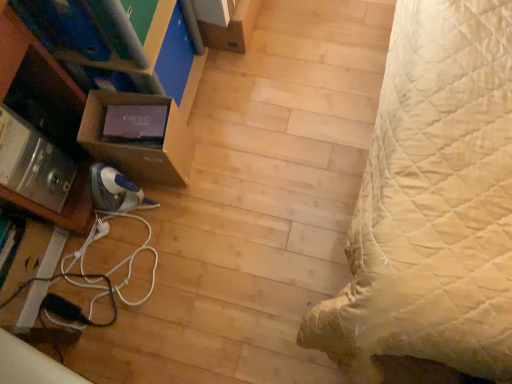
What is the approximate width of matte black monitor at left?

matte black monitor at left is 35.05 centimeters wide.

What do you see at coordinates (26, 51) in the screenshot?
I see `matte black monitor at left` at bounding box center [26, 51].

You are a GUI agent. You are given a task and a screenshot of the screen. Output one action in this format:
    pyautogui.click(x=<x>, y=<y>)
    Task: Click on the metallic silver shelf at lower left, arranged as the first shelf when viewed from the left
    This screenshot has width=512, height=384.
    Given the screenshot: What is the action you would take?
    pyautogui.click(x=35, y=67)

Measure the distance between metallic silver shelf at lower left, arranged as the first shelf when viewed from the left, and camera.

metallic silver shelf at lower left, arranged as the first shelf when viewed from the left, is 30.15 inches away from camera.

At what (x,y) coordinates should I click in order to perform the action: click on matte black monitor at left. Please return your answer as a coordinate pair (x, y). Looking at the image, I should click on (26, 51).

Is metallic silver shelf at lower left, arranged as the first shelf when viewed from the left, shorter than brown cardboard box at left, the 2th shelf positioned from the left?

No.

Considering the positions of objects metallic silver shelf at lower left, marked as the 2th shelf in a right-to-left arrangement, and brown cardboard box at left, the 2th shelf positioned from the left, in the image provided, who is in front, metallic silver shelf at lower left, marked as the 2th shelf in a right-to-left arrangement, or brown cardboard box at left, the 2th shelf positioned from the left,?

metallic silver shelf at lower left, marked as the 2th shelf in a right-to-left arrangement, is closer to the camera.

How different are the orientations of metallic silver shelf at lower left, marked as the 2th shelf in a right-to-left arrangement, and brown cardboard box at left, placed as the 1th shelf when sorted from right to left, in degrees?

The angle between the facing direction of metallic silver shelf at lower left, marked as the 2th shelf in a right-to-left arrangement, and the facing direction of brown cardboard box at left, placed as the 1th shelf when sorted from right to left, is 0.000542 degrees.

Is point (58, 77) positioned behind point (170, 170)?

No, (58, 77) is in front of (170, 170).

Does brown cardboard box at left, the 2th shelf positioned from the left, have a greater width compared to white cord at lower left?

Indeed, brown cardboard box at left, the 2th shelf positioned from the left, has a greater width compared to white cord at lower left.

Is white cord at lower left at the back of brown cardboard box at left, placed as the 1th shelf when sorted from right to left?

brown cardboard box at left, placed as the 1th shelf when sorted from right to left, does not have its back to white cord at lower left.

At what (x,y) coordinates should I click in order to perform the action: click on shelf that appears on the right of white cord at lower left. Please return your answer as a coordinate pair (x, y). Image resolution: width=512 pixels, height=384 pixels. Looking at the image, I should click on (140, 146).

Can we say brown cardboard box at left, placed as the 1th shelf when sorted from right to left, lies outside white cord at lower left?

Yes, brown cardboard box at left, placed as the 1th shelf when sorted from right to left, is located beyond the bounds of white cord at lower left.

Can you confirm if white cord at lower left is shorter than metallic silver shelf at lower left, marked as the 2th shelf in a right-to-left arrangement?

Indeed, white cord at lower left has a lesser height compared to metallic silver shelf at lower left, marked as the 2th shelf in a right-to-left arrangement.

From the image's perspective, count 1st shelfs upward from the white cord at lower left and point to it. Please provide its 2D coordinates.

[(35, 67)]

Is white cord at lower left wider than metallic silver shelf at lower left, marked as the 2th shelf in a right-to-left arrangement?

In fact, white cord at lower left might be narrower than metallic silver shelf at lower left, marked as the 2th shelf in a right-to-left arrangement.

From the image's perspective, is white cord at lower left on metallic silver shelf at lower left, arranged as the first shelf when viewed from the left?

Incorrect, from the image's perspective, white cord at lower left is lower than metallic silver shelf at lower left, arranged as the first shelf when viewed from the left.

Who is more distant, white cord at lower left or matte black monitor at left?

white cord at lower left is more distant.

Is white cord at lower left far away from matte black monitor at left?

No, white cord at lower left is in close proximity to matte black monitor at left.

Is white cord at lower left oriented away from matte black monitor at left?

That's not correct — white cord at lower left is not looking away from matte black monitor at left.

I want to click on cable lying behind the matte black monitor at left, so click(x=105, y=273).

Image resolution: width=512 pixels, height=384 pixels. What are the coordinates of `the 1st shelf located beneath the matte black monitor at left (from a real-world perspective)` in the screenshot? It's located at (35, 67).

Considering the points (69, 78) and (19, 200), which point is in front, point (69, 78) or point (19, 200)?

The point (19, 200) is more forward.

Is metallic silver shelf at lower left, marked as the 2th shelf in a right-to-left arrangement, far from matte black monitor at left?

metallic silver shelf at lower left, marked as the 2th shelf in a right-to-left arrangement, is near matte black monitor at left, not far away.

Considering the sizes of objects metallic silver shelf at lower left, arranged as the first shelf when viewed from the left, and matte black monitor at left in the image provided, who is wider, metallic silver shelf at lower left, arranged as the first shelf when viewed from the left, or matte black monitor at left?

matte black monitor at left.

From a real-world perspective, is matte black monitor at left positioned above or below white cord at lower left?

matte black monitor at left is above white cord at lower left.

Does matte black monitor at left have a greater width compared to white cord at lower left?

Indeed, matte black monitor at left has a greater width compared to white cord at lower left.

Considering the relative sizes of matte black monitor at left and white cord at lower left in the image provided, is matte black monitor at left taller than white cord at lower left?

Yes.

Is matte black monitor at left not inside metallic silver shelf at lower left, arranged as the first shelf when viewed from the left?

Yes.

Relative to metallic silver shelf at lower left, marked as the 2th shelf in a right-to-left arrangement, is matte black monitor at left in front or behind?

Clearly, matte black monitor at left is in front of metallic silver shelf at lower left, marked as the 2th shelf in a right-to-left arrangement.

Is matte black monitor at left bigger than metallic silver shelf at lower left, arranged as the first shelf when viewed from the left?

Yes, matte black monitor at left is bigger than metallic silver shelf at lower left, arranged as the first shelf when viewed from the left.

Considering the positions of objects matte black monitor at left and metallic silver shelf at lower left, arranged as the first shelf when viewed from the left, in the image provided, who is more to the right, matte black monitor at left or metallic silver shelf at lower left, arranged as the first shelf when viewed from the left,?

matte black monitor at left is more to the right.

In order to click on shelf located in front of the brown cardboard box at left, the 2th shelf positioned from the left in this screenshot , I will do `click(35, 67)`.

Locate an element on the screen. The image size is (512, 384). cable on the left of brown cardboard box at left, placed as the 1th shelf when sorted from right to left is located at coordinates (105, 273).

Which object lies nearer to the anchor point brown cardboard box at left, placed as the 1th shelf when sorted from right to left, matte black monitor at left or metallic silver shelf at lower left, arranged as the first shelf when viewed from the left?

metallic silver shelf at lower left, arranged as the first shelf when viewed from the left, is closer to brown cardboard box at left, placed as the 1th shelf when sorted from right to left.

Which object lies nearer to the anchor point metallic silver shelf at lower left, arranged as the first shelf when viewed from the left, matte black monitor at left or white cord at lower left?

Based on the image, matte black monitor at left appears to be nearer to metallic silver shelf at lower left, arranged as the first shelf when viewed from the left.

When comparing their distances from brown cardboard box at left, placed as the 1th shelf when sorted from right to left, does metallic silver shelf at lower left, marked as the 2th shelf in a right-to-left arrangement, or matte black monitor at left seem further?

matte black monitor at left is positioned further to the anchor brown cardboard box at left, placed as the 1th shelf when sorted from right to left.

Looking at the image, which one is located closer to brown cardboard box at left, the 2th shelf positioned from the left, white cord at lower left or metallic silver shelf at lower left, arranged as the first shelf when viewed from the left?

metallic silver shelf at lower left, arranged as the first shelf when viewed from the left, is closer to brown cardboard box at left, the 2th shelf positioned from the left.

Estimate the real-world distances between objects in this image. Which object is further from brown cardboard box at left, placed as the 1th shelf when sorted from right to left, matte black monitor at left or white cord at lower left?

Among the two, white cord at lower left is located further to brown cardboard box at left, placed as the 1th shelf when sorted from right to left.

When comparing their distances from white cord at lower left, does metallic silver shelf at lower left, arranged as the first shelf when viewed from the left, or brown cardboard box at left, the 2th shelf positioned from the left, seem further?

Among the two, metallic silver shelf at lower left, arranged as the first shelf when viewed from the left, is located further to white cord at lower left.

Based on their spatial positions, is white cord at lower left or brown cardboard box at left, the 2th shelf positioned from the left, further from metallic silver shelf at lower left, marked as the 2th shelf in a right-to-left arrangement?

white cord at lower left lies further to metallic silver shelf at lower left, marked as the 2th shelf in a right-to-left arrangement, than the other object.

From the image, which object appears to be farther from matte black monitor at left, white cord at lower left or brown cardboard box at left, placed as the 1th shelf when sorted from right to left?

Among the two, white cord at lower left is located further to matte black monitor at left.

The image size is (512, 384). Find the location of `shelf between matte black monitor at left and metallic silver shelf at lower left, arranged as the first shelf when viewed from the left, in the vertical direction`. shelf between matte black monitor at left and metallic silver shelf at lower left, arranged as the first shelf when viewed from the left, in the vertical direction is located at coordinates (140, 146).

The image size is (512, 384). What are the coordinates of `shelf between brown cardboard box at left, placed as the 1th shelf when sorted from right to left, and white cord at lower left vertically` in the screenshot? It's located at (35, 67).